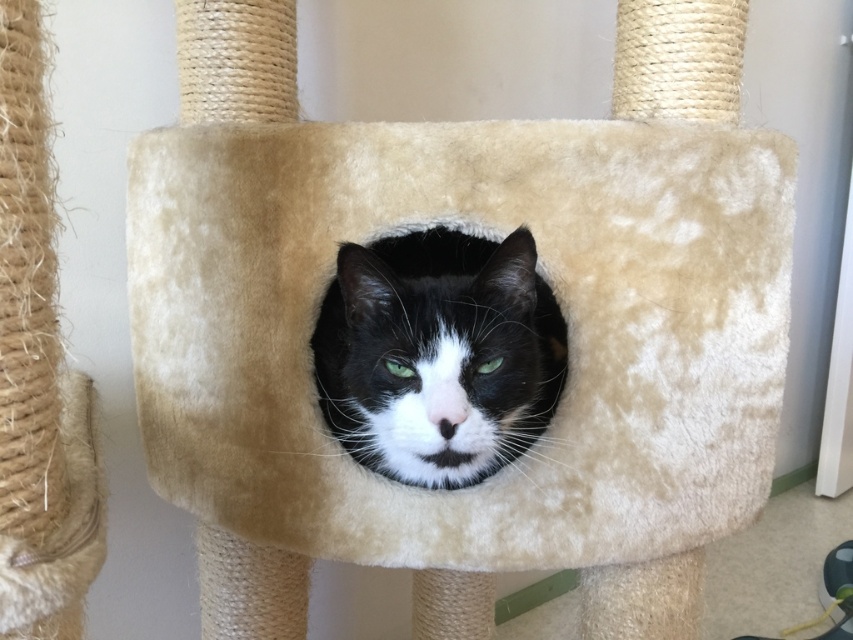
You are a cat owner who wants to buy a new cat bed for your cat. Looking at the image, can you determine if the beige plush cat bed at center is wider than the black fur cat at center?

The beige plush cat bed at center is wider than the black fur cat at center, so yes, the beige plush cat bed at center is wider than the black fur cat at center.

You are a cat owner who wants to ensure your cat can easily access its cat bed. Based on the image, is the beige plush cat bed at center positioned to the left or right of the black fur cat at center?

The beige plush cat bed at center is to the right of the black fur cat at center according to the description.